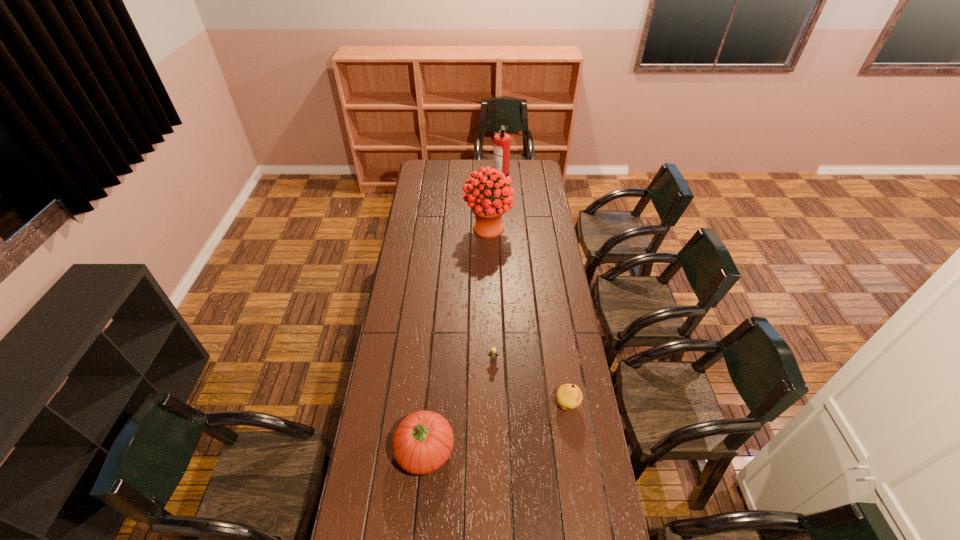
Locate an element on the screen. vacant space at the far left corner of the desktop is located at coordinates (425, 174).

The height and width of the screenshot is (540, 960). I want to click on free space at the far right corner, so click(x=520, y=166).

Where is `blank region between the rightmost object and the third farthest object`? blank region between the rightmost object and the third farthest object is located at coordinates (530, 382).

I want to click on free point between the bouquet and the pumpkin, so click(x=456, y=339).

The width and height of the screenshot is (960, 540). What are the coordinates of `free point between the second nearest object and the fire extinguisher` in the screenshot? It's located at (534, 291).

You are a GUI agent. You are given a task and a screenshot of the screen. Output one action in this format:
    pyautogui.click(x=<x>, y=<y>)
    Task: Click on the free space between the bouquet and the leftmost object
    The height and width of the screenshot is (540, 960).
    Given the screenshot: What is the action you would take?
    pyautogui.click(x=456, y=339)

Where is `free spot between the Lego and the third shortest object`? free spot between the Lego and the third shortest object is located at coordinates (459, 405).

In order to click on empty location between the fourth tallest object and the farthest object in this screenshot , I will do `click(534, 291)`.

Locate an element on the screen. free space between the second nearest object and the farthest object is located at coordinates (534, 291).

The width and height of the screenshot is (960, 540). Find the location of `free spot between the nearest object and the second nearest object`. free spot between the nearest object and the second nearest object is located at coordinates (496, 427).